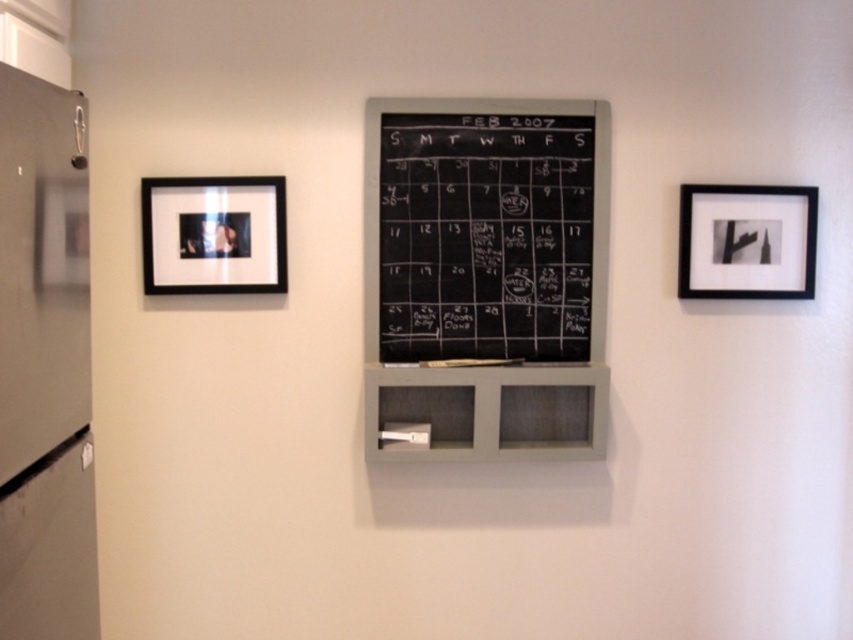
Is point (166, 189) positioned in front of point (811, 253)?

Yes, it is.

Between point (161, 205) and point (804, 216), which one is positioned behind?

Point (804, 216)

Locate an element on the screen. The width and height of the screenshot is (853, 640). black matte picture frame at left is located at coordinates (x=213, y=234).

Who is lower down, metallic refrigerator at left or black matte picture frame at left?

metallic refrigerator at left is lower down.

Identify the location of metallic refrigerator at left. (44, 364).

What do you see at coordinates (44, 364) in the screenshot? I see `metallic refrigerator at left` at bounding box center [44, 364].

I want to click on metallic refrigerator at left, so click(x=44, y=364).

Consider the image. Between black chalkboard at center and black matte picture frame at left, which one has less height?

Standing shorter between the two is black matte picture frame at left.

Is black chalkboard at center above black matte picture frame at left?

Indeed, black chalkboard at center is positioned over black matte picture frame at left.

Identify the location of black chalkboard at center. Image resolution: width=853 pixels, height=640 pixels. (485, 228).